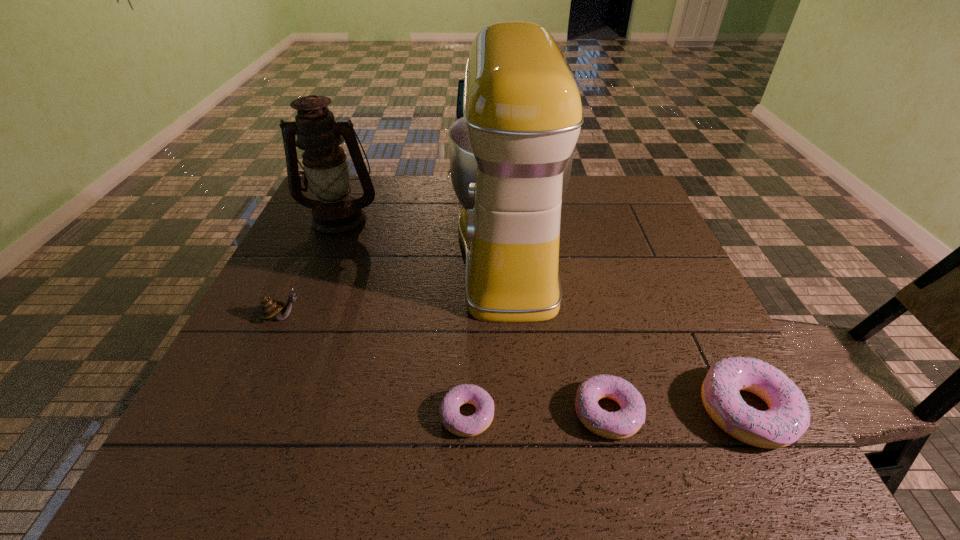
In the current image, all doughnuts are evenly spaced. To maintain this equal spacing, where should an additional doughnut be placed on the left? Please point out a free spot. Please provide its 2D coordinates. Your answer should be formatted as a tuple, i.e. [(x, y)], where the tuple contains the x and y coordinates of a point satisfying the conditions above.

[(325, 418)]